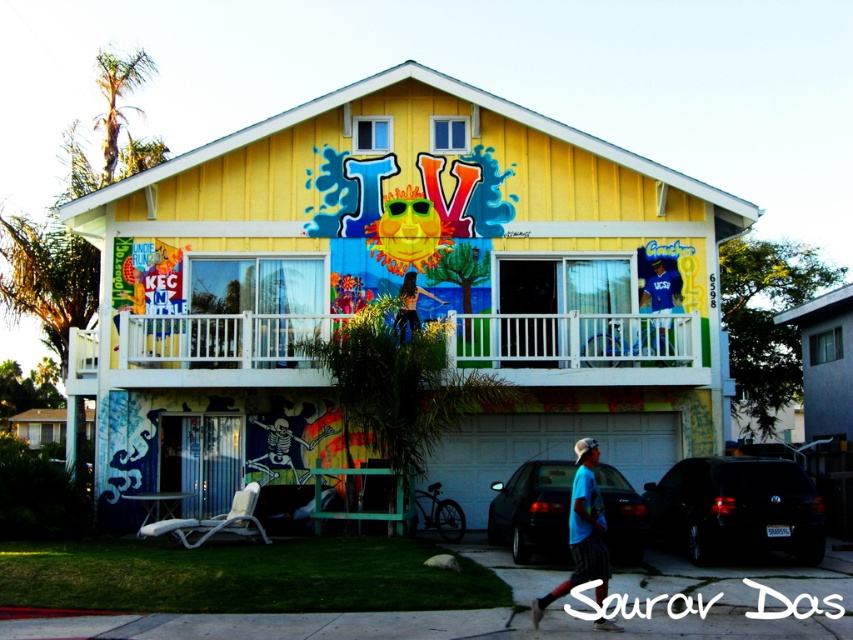
You are standing in front of the house and notice the white plastic railing at upper center and the matte black pants at center. Which object is closer to you?

The white plastic railing at upper center is closer to you because the matte black pants at center is behind it.

You are standing in front of the house and notice two points on the facade. The first point is at coordinates point (529, 483) and the second is at point (578, 440). Which point is closer to you?

Point (529, 483) is closer to the camera than point (578, 440).